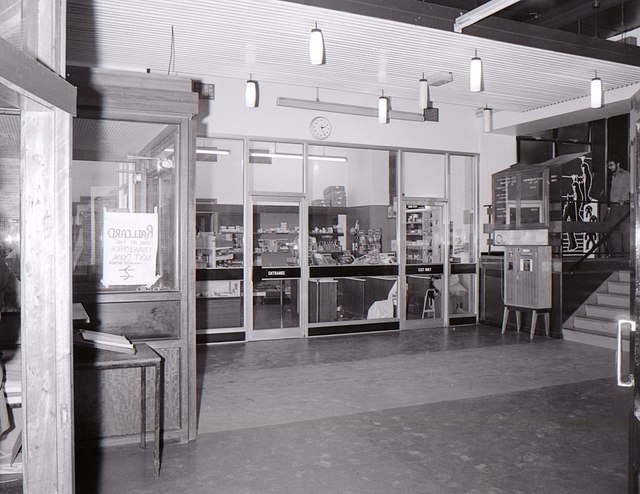
Locate an element on the screen. This screenshot has height=494, width=640. light is located at coordinates (317, 41), (250, 95), (386, 113), (424, 95), (477, 83), (488, 132), (600, 101).